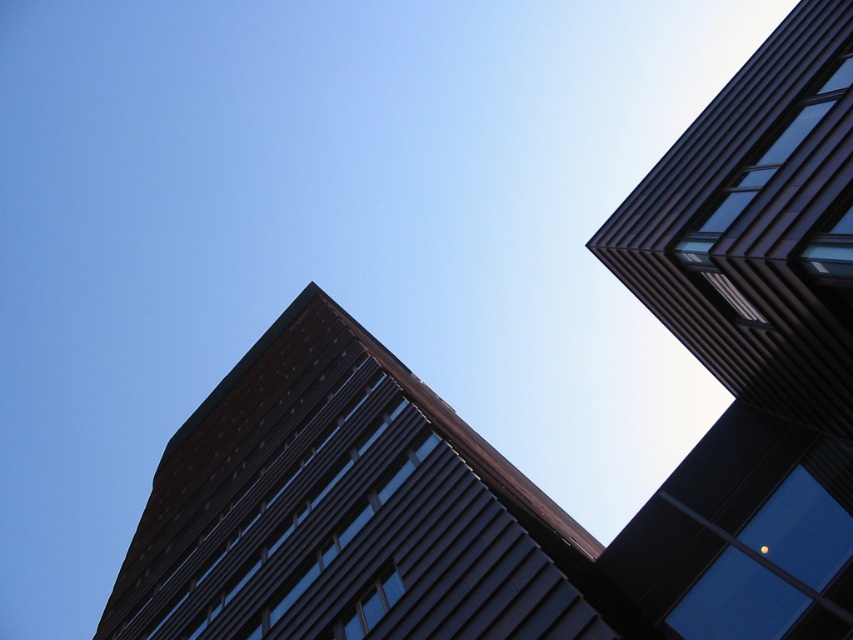
Question: Which point is closer to the camera taking this photo?

Choices:
 (A) (692, 307)
 (B) (418, 547)

Answer: (B)

Question: Considering the relative positions of metallic glass building at upper right and dark brown glass building at center in the image provided, where is metallic glass building at upper right located with respect to dark brown glass building at center?

Choices:
 (A) below
 (B) above

Answer: (B)

Question: Is metallic glass building at upper right wider than dark brown glass building at center?

Choices:
 (A) yes
 (B) no

Answer: (B)

Question: Is metallic glass building at upper right bigger than dark brown glass building at center?

Choices:
 (A) no
 (B) yes

Answer: (A)

Question: Which object appears farthest from the camera in this image?

Choices:
 (A) dark brown glass building at center
 (B) metallic glass building at upper right

Answer: (B)